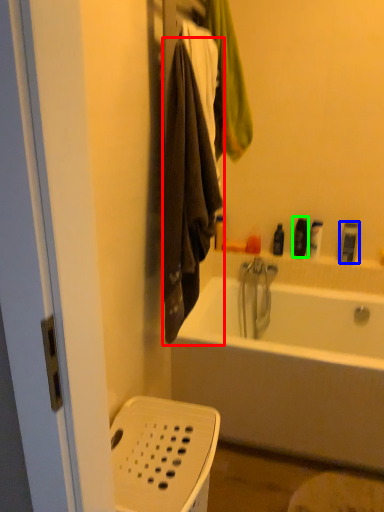
Question: Considering the real-world distances, which object is closest to towel/napkin (highlighted by a red box)? toiletry (highlighted by a blue box) or toiletry (highlighted by a green box).

Choices:
 (A) toiletry
 (B) toiletry

Answer: (B)